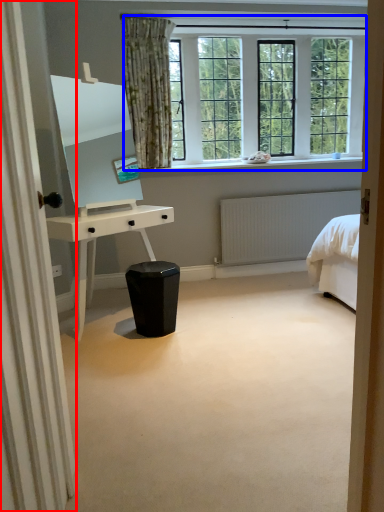
Question: Which object appears farthest to the camera in this image, curtain (highlighted by a red box) or window (highlighted by a blue box)?

Choices:
 (A) curtain
 (B) window

Answer: (B)